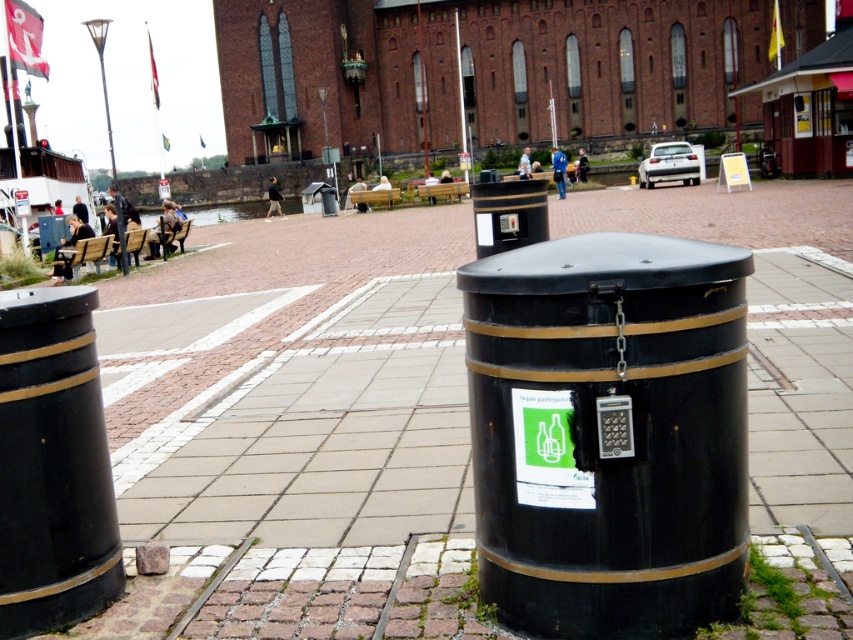
You are a delivery person who needs to place a large package on the ground near the matte black barrel at left and the metallic streetlamp at upper left. Which object should you avoid placing the package in front of to ensure it doesn

The metallic streetlamp at upper left is taller than the matte black barrel at left, so placing the package in front of the streetlamp might block its light or pose a safety hazard. Choose the area in front of the matte black barrel at left instead.

You are a city planner reviewing this public square layout. You need to install a new security camera that requires a mounting point at least 3 meters high. Which object between the metallic streetlamp at upper left and the metallic pole at upper center would be suitable for this installation?

The metallic streetlamp at upper left is taller than the metallic pole at upper center, so it would be suitable for mounting the security camera as it meets the height requirement of at least 3 meters.

You are a delivery person approaching the plaza and need to place a package near the matte black barrel at left and the metallic streetlamp at upper left. Which object should you place the package closer to if you want it to be more visible to people entering the plaza?

The matte black barrel at left is closer to the viewer than the metallic streetlamp at upper left, so placing the package near the matte black barrel at left would make it more visible to people entering the plaza.